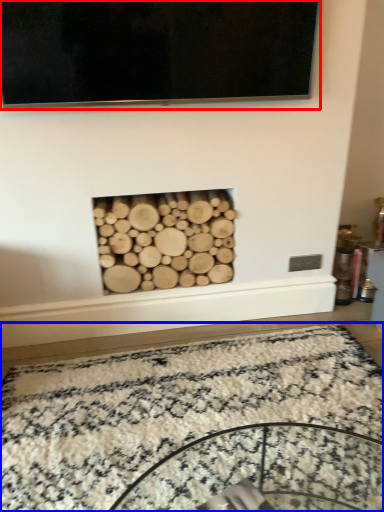
Question: Among these objects, which one is nearest to the camera, television (highlighted by a red box) or mat (highlighted by a blue box)?

Choices:
 (A) television
 (B) mat

Answer: (B)